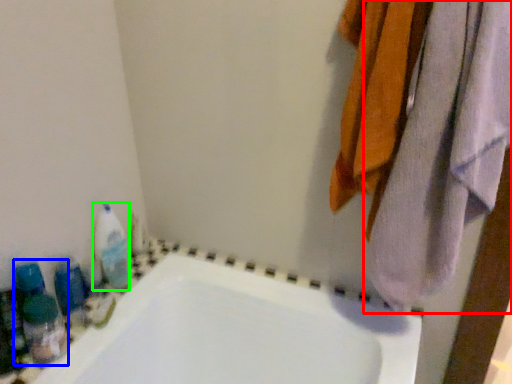
Question: Estimate the real-world distances between objects in this image. Which object is closer to towel (highlighted by a red box), cleaning product (highlighted by a blue box) or cleaning product (highlighted by a green box)?

Choices:
 (A) cleaning product
 (B) cleaning product

Answer: (B)